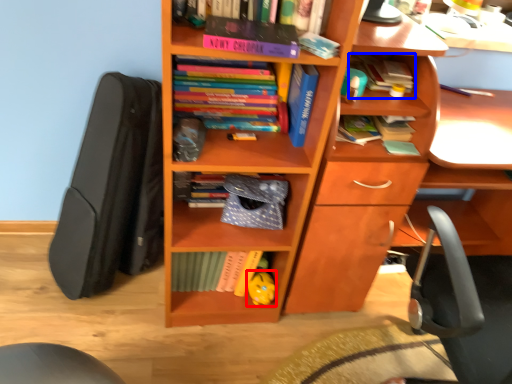
Question: Which point is further to the camera, toy (highlighted by a red box) or book (highlighted by a blue box)?

Choices:
 (A) toy
 (B) book

Answer: (A)